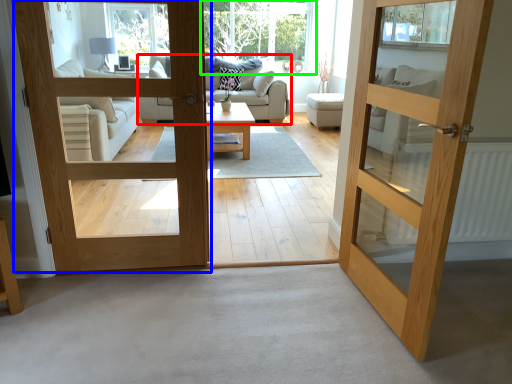
Question: Based on their relative distances, which object is farther from studio couch (highlighted by a red box)? Choose from door (highlighted by a blue box) and window (highlighted by a green box).

Choices:
 (A) door
 (B) window

Answer: (A)